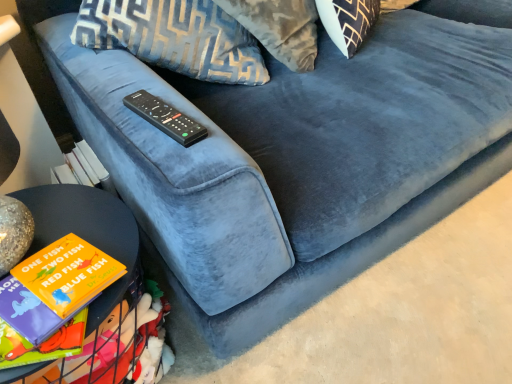
Locate an element on the screen. vacant space underneath matte black table at lower left (from a real-world perspective) is located at coordinates (75, 309).